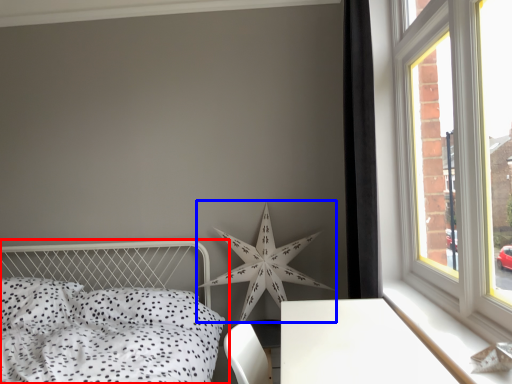
Question: Which object appears closest to the camera in this image, bed (highlighted by a red box) or star (highlighted by a blue box)?

Choices:
 (A) bed
 (B) star

Answer: (A)